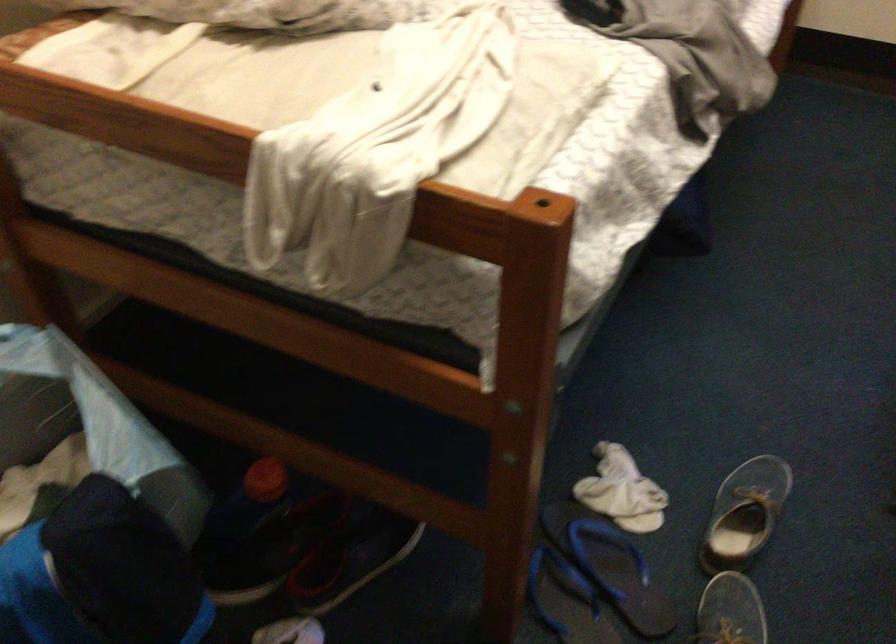
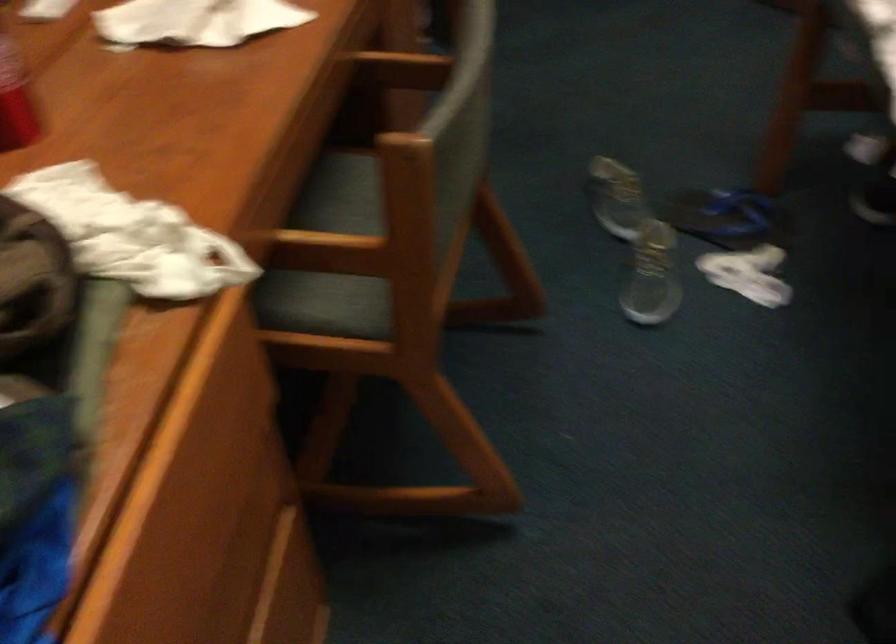
The point at (x=597, y=559) is marked in the first image. Where is the corresponding point in the second image?

(728, 218)